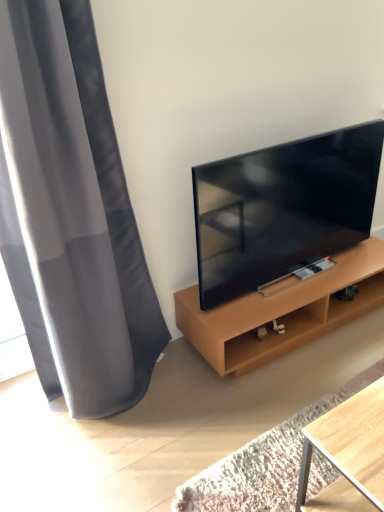
Question: Is matte black tv at right positioned in front of wooden shelf at right?

Choices:
 (A) no
 (B) yes

Answer: (B)

Question: From the image's perspective, is matte black tv at right on wooden shelf at right?

Choices:
 (A) no
 (B) yes

Answer: (B)

Question: Is matte black tv at right outside of wooden shelf at right?

Choices:
 (A) no
 (B) yes

Answer: (B)

Question: Does matte black tv at right have a greater width compared to wooden shelf at right?

Choices:
 (A) yes
 (B) no

Answer: (B)

Question: From a real-world perspective, does matte black tv at right sit lower than wooden shelf at right?

Choices:
 (A) no
 (B) yes

Answer: (A)

Question: Considering the positions of gray fabric curtain at left and wooden shelf at right in the image, is gray fabric curtain at left taller or shorter than wooden shelf at right?

Choices:
 (A) short
 (B) tall

Answer: (B)

Question: Considering the positions of point (92, 286) and point (185, 331), is point (92, 286) closer or farther from the camera than point (185, 331)?

Choices:
 (A) closer
 (B) farther

Answer: (A)

Question: Relative to wooden shelf at right, is gray fabric curtain at left in front or behind?

Choices:
 (A) front
 (B) behind

Answer: (A)

Question: Is gray fabric curtain at left to the left or to the right of wooden shelf at right in the image?

Choices:
 (A) right
 (B) left

Answer: (B)

Question: Would you say wooden shelf at right is to the left or to the right of matte black tv at right in the picture?

Choices:
 (A) left
 (B) right

Answer: (B)

Question: From a real-world perspective, is wooden shelf at right positioned above or below matte black tv at right?

Choices:
 (A) above
 (B) below

Answer: (B)

Question: Is wooden shelf at right taller or shorter than matte black tv at right?

Choices:
 (A) tall
 (B) short

Answer: (B)

Question: Is wooden shelf at right inside or outside of matte black tv at right?

Choices:
 (A) inside
 (B) outside

Answer: (B)

Question: From their relative heights in the image, would you say matte black tv at right is taller or shorter than wooden shelf at right?

Choices:
 (A) tall
 (B) short

Answer: (A)

Question: From a real-world perspective, relative to wooden shelf at right, is matte black tv at right vertically above or below?

Choices:
 (A) below
 (B) above

Answer: (B)